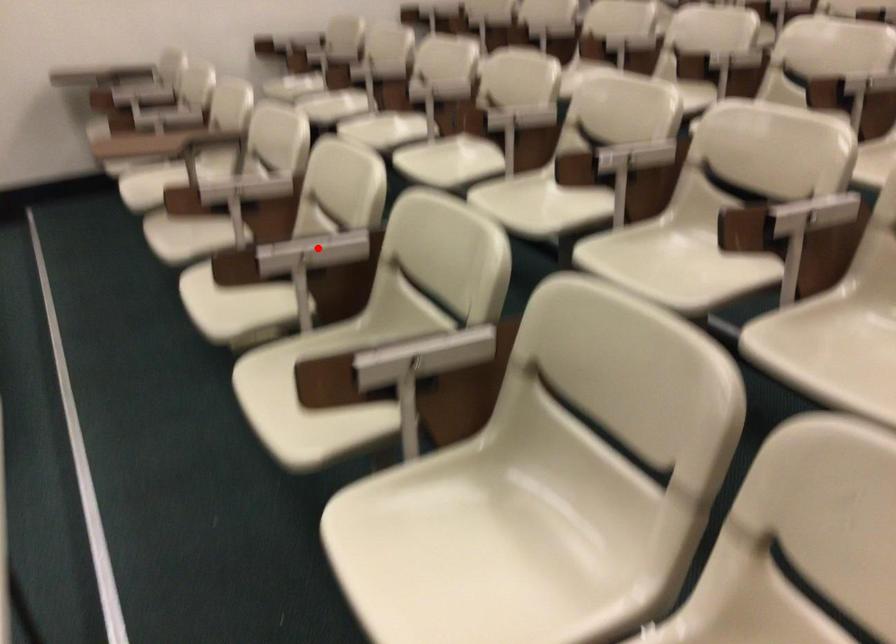
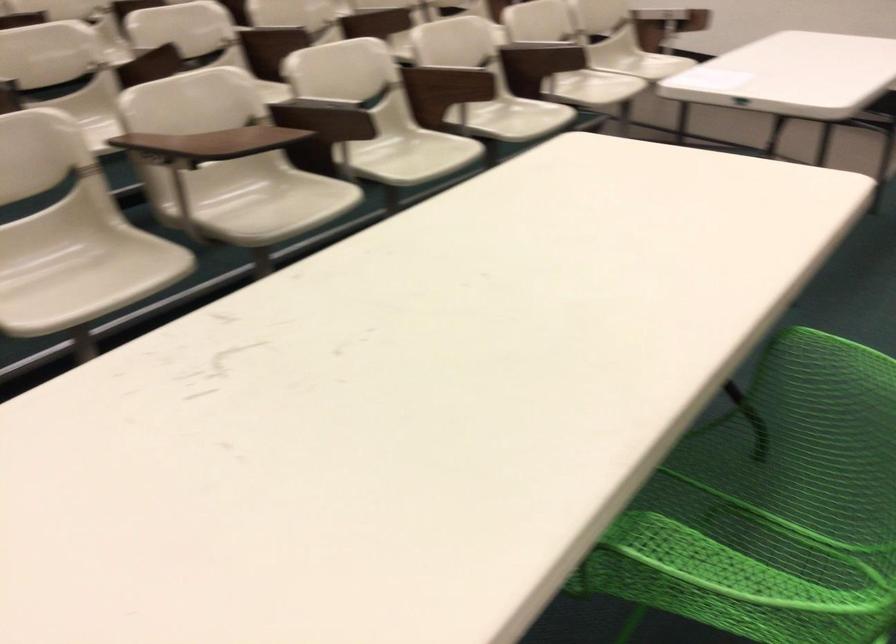
Question: I am providing you with two images of the same scene from different viewpoints. A red point is marked on the first image. Is the red point's position out of view in image 2?

Choices:
 (A) Yes
 (B) No

Answer: (B)